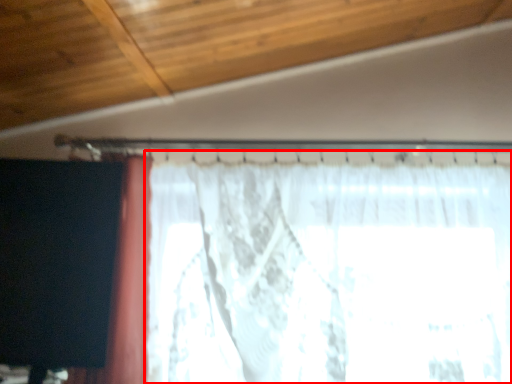
Question: From the image's perspective, what is the correct spatial relationship of curtain (annotated by the red box) in relation to curtain?

Choices:
 (A) below
 (B) above

Answer: (A)